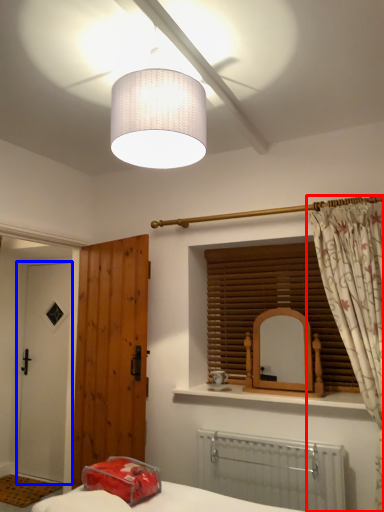
Question: Which object appears closest to the camera in this image, curtain (highlighted by a red box) or door (highlighted by a blue box)?

Choices:
 (A) curtain
 (B) door

Answer: (A)